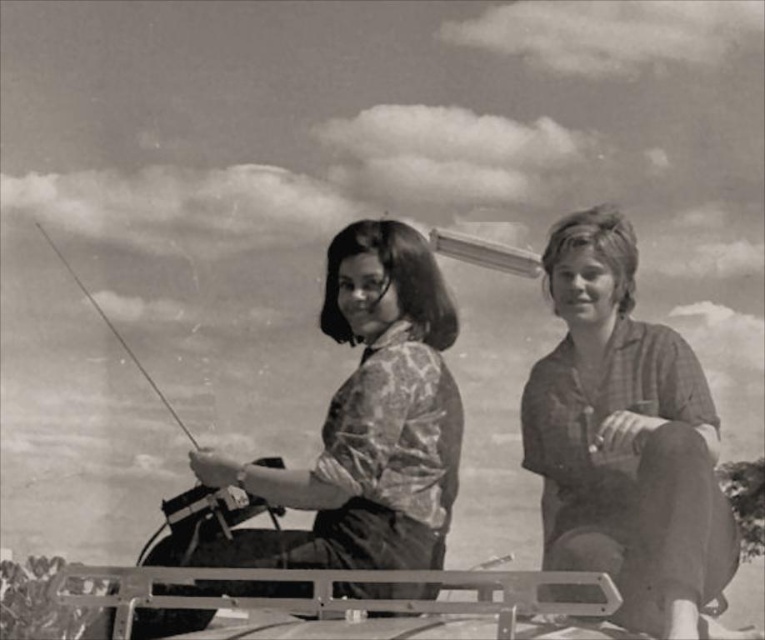
Question: Can you confirm if plaid shirt at right is positioned below patterned fabric shirt at center?

Choices:
 (A) no
 (B) yes

Answer: (B)

Question: Among these points, which one is farthest from the camera?

Choices:
 (A) (583, 401)
 (B) (448, 323)

Answer: (A)

Question: Does plaid shirt at right lie in front of patterned fabric shirt at center?

Choices:
 (A) yes
 (B) no

Answer: (A)

Question: Which point is farther to the camera?

Choices:
 (A) (249, 545)
 (B) (578, 320)

Answer: (B)

Question: Can you confirm if plaid shirt at right is positioned to the right of patterned fabric shirt at center?

Choices:
 (A) no
 (B) yes

Answer: (B)

Question: Which point is closer to the camera?

Choices:
 (A) (389, 417)
 (B) (599, 458)

Answer: (A)